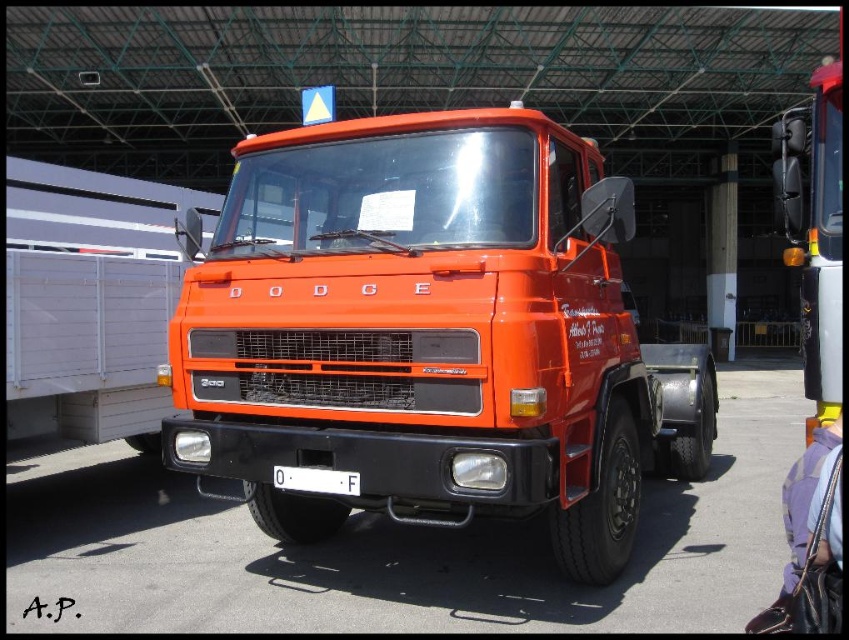
Who is higher up, orange matte truck at center or white plastic license plate at center?

Positioned higher is orange matte truck at center.

I want to click on orange matte truck at center, so click(x=431, y=333).

What do you see at coordinates (431, 333) in the screenshot? The width and height of the screenshot is (849, 640). I see `orange matte truck at center` at bounding box center [431, 333].

Identify the location of orange matte truck at center. This screenshot has height=640, width=849. (431, 333).